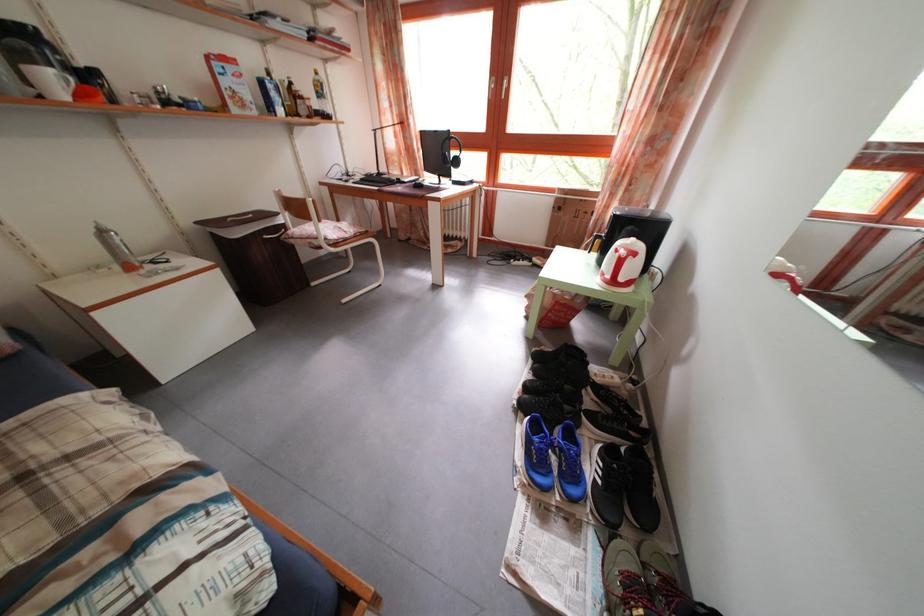
Identify the location of black computer mouse. Image resolution: width=924 pixels, height=616 pixels. (418, 184).